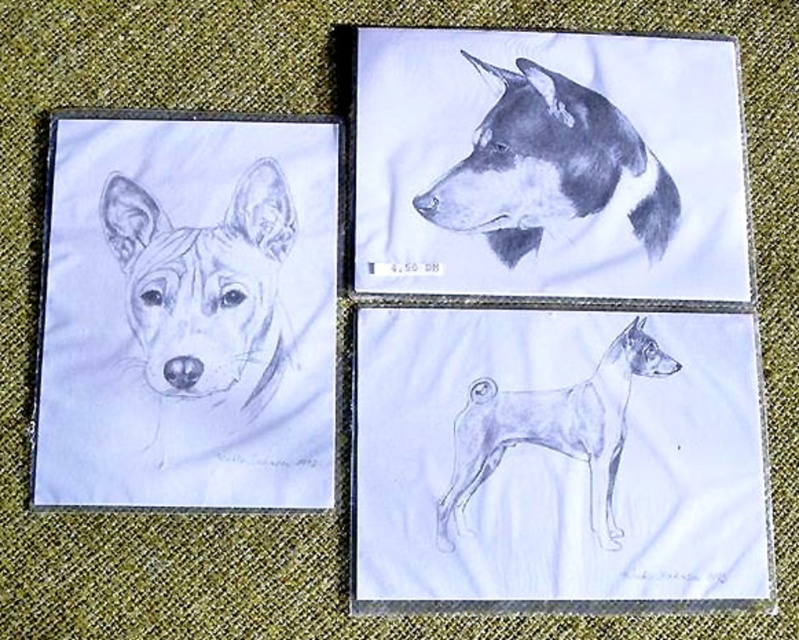
In the scene shown: Can you confirm if graphite sketch of dog at upper left is taller than graphite sketch dog at upper center?

Yes, graphite sketch of dog at upper left is taller than graphite sketch dog at upper center.

Looking at this image, can you confirm if graphite sketch of dog at upper left is shorter than graphite sketch dog at upper center?

In fact, graphite sketch of dog at upper left may be taller than graphite sketch dog at upper center.

Between point (252, 300) and point (629, 134), which one is positioned in front?

Positioned in front is point (252, 300).

Identify the location of graphite sketch of dog at upper left. Image resolution: width=799 pixels, height=640 pixels. (205, 289).

Between point (229, 324) and point (571, 397), which one is positioned behind?

Point (229, 324)

Does graphite sketch of dog at upper left lie in front of graphite sketch dog at center?

No, graphite sketch of dog at upper left is further to the viewer.

This screenshot has height=640, width=799. Describe the element at coordinates (205, 289) in the screenshot. I see `graphite sketch of dog at upper left` at that location.

You are a GUI agent. You are given a task and a screenshot of the screen. Output one action in this format:
    pyautogui.click(x=<x>, y=<y>)
    Task: Click on the graphite sketch of dog at upper left
    The height and width of the screenshot is (640, 799).
    Given the screenshot: What is the action you would take?
    pyautogui.click(x=205, y=289)

Does graphite sketch dog at upper center lie behind graphite sketch dog at center?

Yes, graphite sketch dog at upper center is further from the viewer.

Can you confirm if graphite sketch dog at upper center is wider than graphite sketch dog at center?

Indeed, graphite sketch dog at upper center has a greater width compared to graphite sketch dog at center.

Identify the location of graphite sketch dog at upper center. This screenshot has width=799, height=640. (549, 168).

This screenshot has height=640, width=799. I want to click on graphite sketch dog at upper center, so click(x=549, y=168).